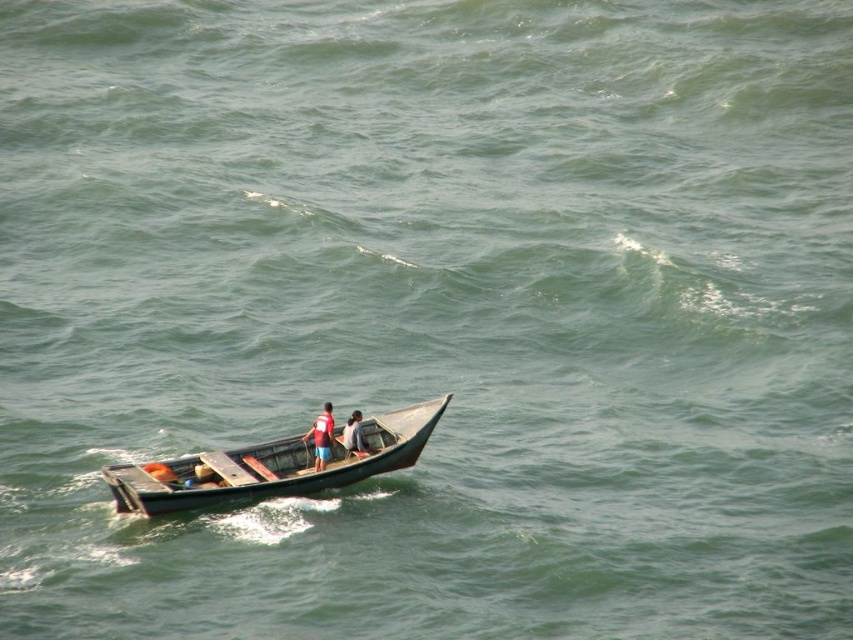
Question: Estimate the real-world distances between objects in this image. Which object is farther from the wooden boat at center?

Choices:
 (A) matte red life vest at center
 (B) red fabric shirt at center

Answer: (B)

Question: Does matte red life vest at center have a greater width compared to red fabric shirt at center?

Choices:
 (A) no
 (B) yes

Answer: (B)

Question: Which object is closer to the camera taking this photo?

Choices:
 (A) matte red life vest at center
 (B) red fabric shirt at center

Answer: (A)

Question: Which point appears farthest from the camera in this image?

Choices:
 (A) (316, 433)
 (B) (312, 472)
 (C) (347, 451)

Answer: (C)

Question: Does wooden boat at center have a smaller size compared to matte red life vest at center?

Choices:
 (A) no
 (B) yes

Answer: (A)

Question: Can you confirm if wooden boat at center is positioned below red fabric shirt at center?

Choices:
 (A) no
 (B) yes

Answer: (B)